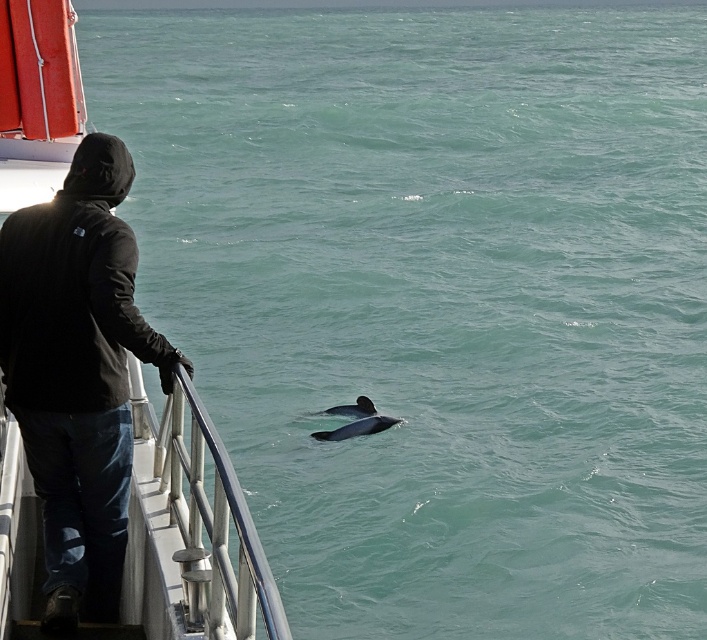
Question: Is metallic boat at left thinner than gray smooth dolphin at center?

Choices:
 (A) no
 (B) yes

Answer: (A)

Question: Which point is farther to the camera?

Choices:
 (A) metallic boat at left
 (B) gray smooth dolphin at center

Answer: (B)

Question: Which of the following is the closest to the observer?

Choices:
 (A) (368, 426)
 (B) (255, 577)

Answer: (B)

Question: Does metallic boat at left appear on the right side of gray smooth dolphin at center?

Choices:
 (A) no
 (B) yes

Answer: (A)

Question: Can you confirm if metallic boat at left is thinner than gray smooth dolphin at center?

Choices:
 (A) no
 (B) yes

Answer: (A)

Question: Which point is farther to the camera?

Choices:
 (A) (151, 480)
 (B) (332, 410)

Answer: (B)